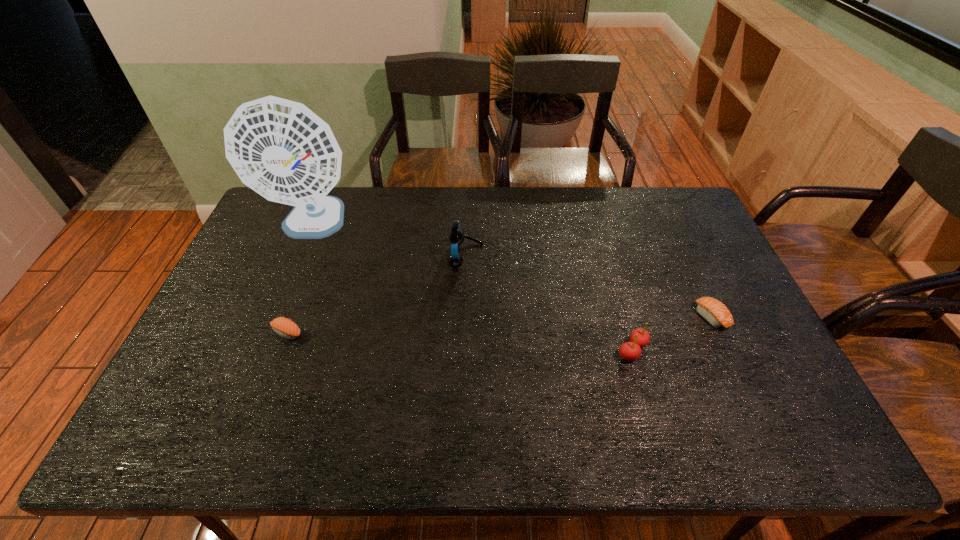
At what (x,y) coordinates should I click in order to perform the action: click on fan. Please return your answer as a coordinate pair (x, y). This screenshot has width=960, height=540. Looking at the image, I should click on (279, 148).

The width and height of the screenshot is (960, 540). Identify the location of the third object from right to left. (456, 236).

Identify the location of the second tallest object. Image resolution: width=960 pixels, height=540 pixels. (456, 236).

In order to click on cherry in this screenshot , I will do `click(629, 351)`.

Where is `the third shortest object`? This screenshot has width=960, height=540. the third shortest object is located at coordinates click(629, 351).

The width and height of the screenshot is (960, 540). What are the coordinates of `the left sushi` in the screenshot? It's located at (x=286, y=328).

Locate an element on the screen. Image resolution: width=960 pixels, height=540 pixels. the right sushi is located at coordinates (716, 313).

Where is `free region located 0.250m on the grille of the tallest object`? free region located 0.250m on the grille of the tallest object is located at coordinates (274, 320).

Locate an element on the screen. The width and height of the screenshot is (960, 540). vacant space situated 0.110m with the microphone attached to the side of the fourth shortest object is located at coordinates (518, 256).

Where is `vacant space situated on the right of the cherry`? The width and height of the screenshot is (960, 540). vacant space situated on the right of the cherry is located at coordinates (x=730, y=350).